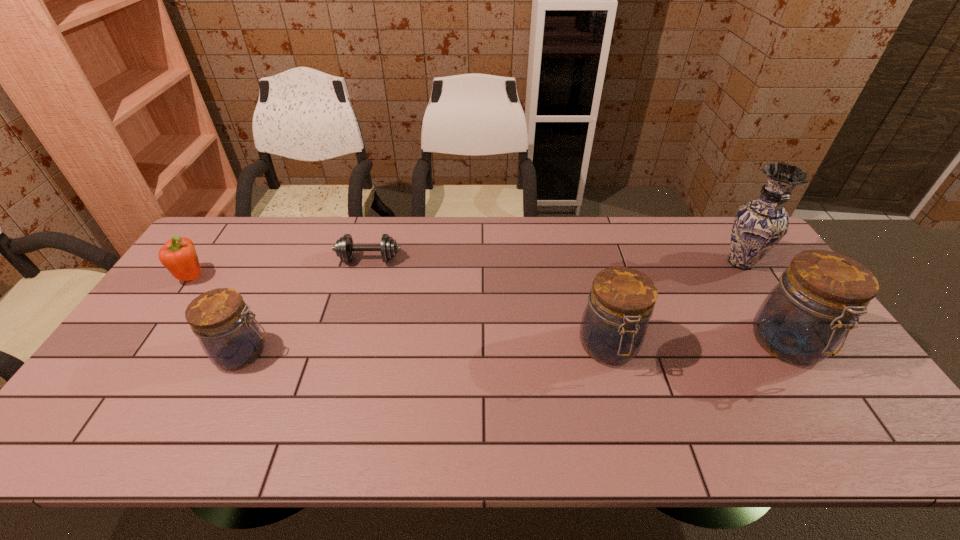
Locate an element on the screen. spot to insert another jar for uniform distribution is located at coordinates (427, 350).